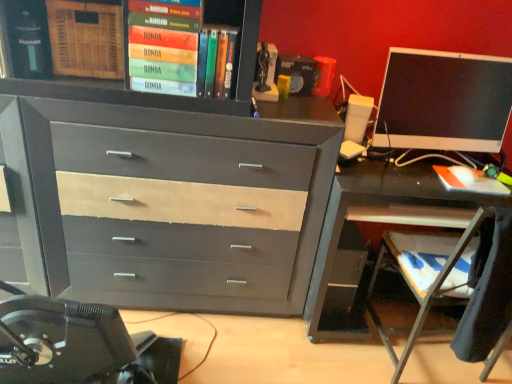
Question: Considering the positions of point (458, 125) and point (207, 74), is point (458, 125) closer or farther from the camera than point (207, 74)?

Choices:
 (A) closer
 (B) farther

Answer: (B)

Question: Relative to hardcover book at upper center, placed as the second book when sorted from bottom to top, is matte black monitor at right in front or behind?

Choices:
 (A) front
 (B) behind

Answer: (B)

Question: Estimate the real-world distances between objects in this image. Which object is farther from the green matte book at upper center, placed as the first book when sorted from top to bottom?

Choices:
 (A) orange matte book at right, the 3th book when ordered from left to right
 (B) wooden at lower right
 (C) matte gray wood chest of drawers at center
 (D) hardcover book at upper center, placed as the second book when sorted from bottom to top
 (E) metallic gray desk at right

Answer: (B)

Question: Which of these objects is positioned closest to the matte gray wood chest of drawers at center?

Choices:
 (A) hardcover book at upper center, which ranks as the 2th book in right-to-left order
 (B) green matte book at upper center, the 1th book positioned from the left
 (C) matte black monitor at right
 (D) orange matte book at right, the first book viewed from the right
 (E) wooden at lower right

Answer: (B)